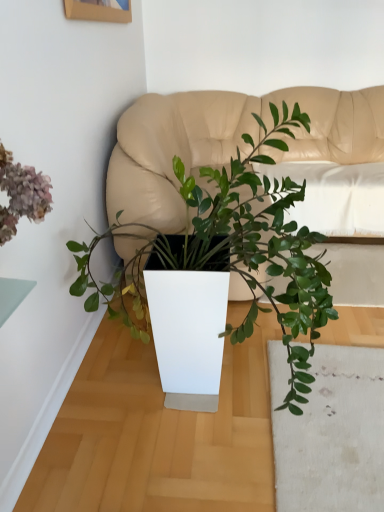
Locate an element on the screen. vacant space underneath green matte plant at center (from a real-world perspective) is located at coordinates (197, 401).